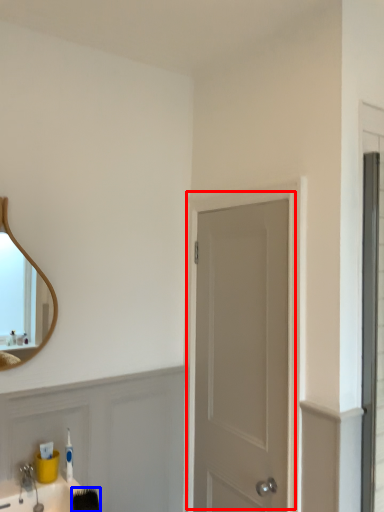
Question: Which object is closer to the camera taking this photo, door (highlighted by a red box) or brush (highlighted by a blue box)?

Choices:
 (A) door
 (B) brush

Answer: (B)